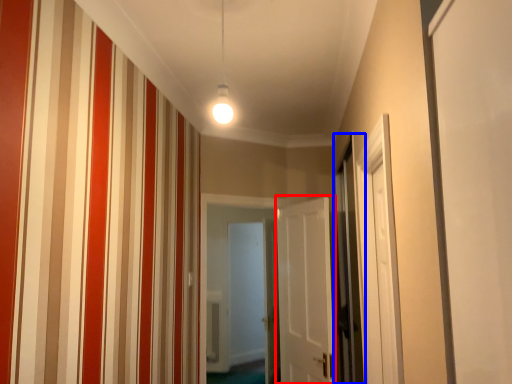
Question: Which point is closer to the camera, door (highlighted by a red box) or screen door (highlighted by a blue box)?

Choices:
 (A) door
 (B) screen door

Answer: (B)